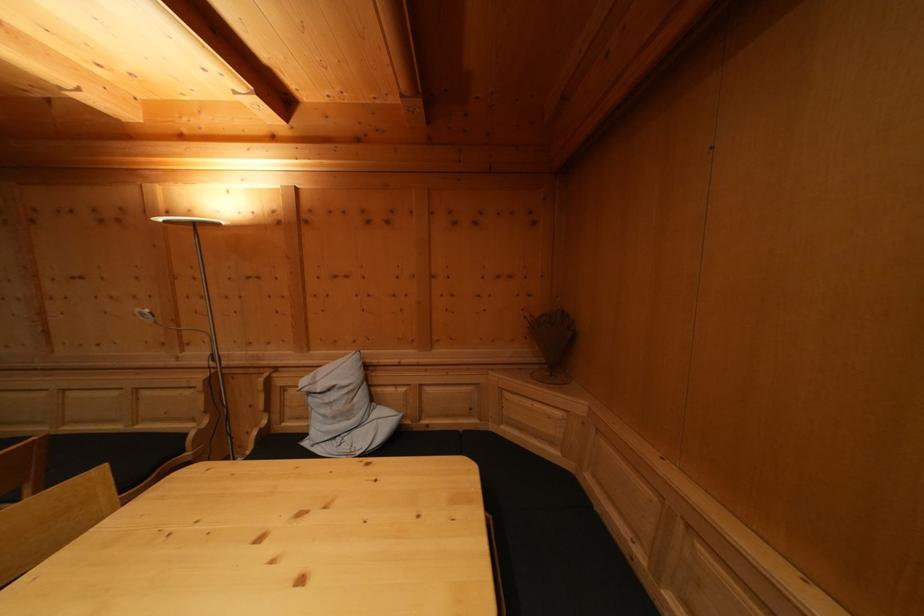
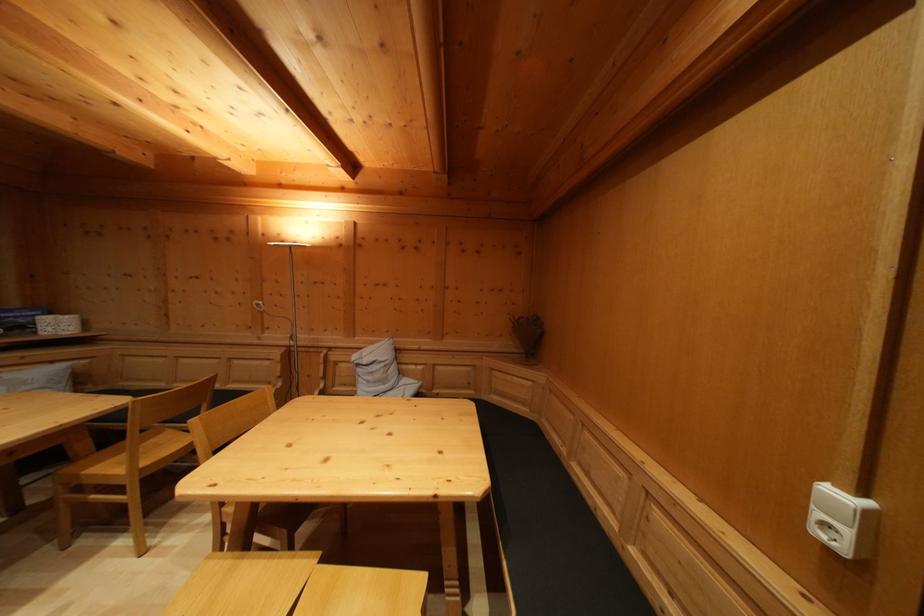
Question: Which direction would the cameraman need to move to produce the second image? Reply with the corresponding letter.

Choices:
 (A) Left
 (B) Right
 (C) Forward
 (D) Backward

Answer: (D)